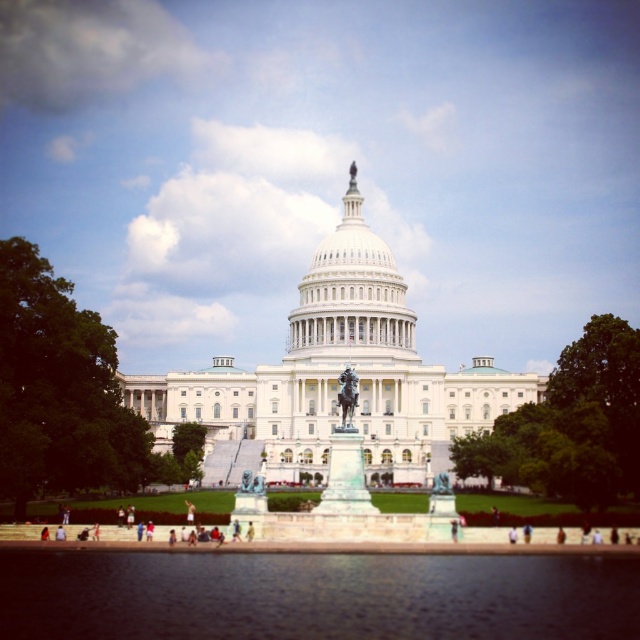
Question: Which object is closer to the camera taking this photo?

Choices:
 (A) green leafy tree at left
 (B) white marble dome at center
 (C) transparent glass water at lower center
 (D) green leafy tree at center

Answer: (C)

Question: Can you confirm if white marble dome at center is positioned above brown leather jacket at lower center?

Choices:
 (A) no
 (B) yes

Answer: (B)

Question: Is white cotton shirt at center in front of brown leather jacket at lower center?

Choices:
 (A) yes
 (B) no

Answer: (A)

Question: Which point appears closest to the camera in this image?

Choices:
 (A) (563, 529)
 (B) (524, 524)
 (C) (588, 406)

Answer: (A)

Question: Which point appears closest to the camera in this image?

Choices:
 (A) pos(333,348)
 (B) pos(28,272)
 (C) pos(525,529)

Answer: (C)

Question: Can you confirm if light brown leather jacket at center is bigger than brown leather jacket at lower center?

Choices:
 (A) no
 (B) yes

Answer: (B)